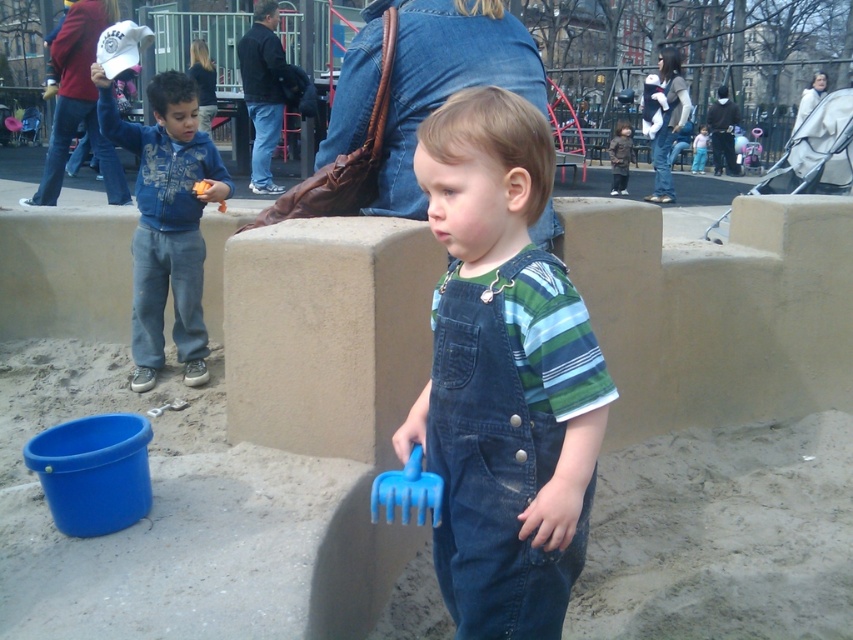
Looking at this image, you are a photographer trying to capture both the denim overalls at center and the blue fleece jacket at left in a single frame. Based on their positions, which direction should you move the camera to include both subjects?

Since the denim overalls at center are to the right of the blue fleece jacket at left, you should move the camera to the left to include both subjects in the frame.

You are a photographer trying to capture a candid shot of the denim overalls at center and the blue fleece jacket at left. Which of the two would you need to get closer to in order to focus on them properly?

The denim overalls at center is closer to the viewer than the blue fleece jacket at left, so you would need to focus on the blue fleece jacket at left to get closer.

You are a photographer trying to capture both the denim overalls at center and the blue fleece jacket at left in a single frame. Based on their sizes, which one would you need to position closer to the camera to ensure both appear equally sized in the photo?

The denim overalls at center has a lesser width compared to the blue fleece jacket at left. To make them appear equally sized in the photo, you should position the denim overalls at center closer to the camera since it is smaller in width.